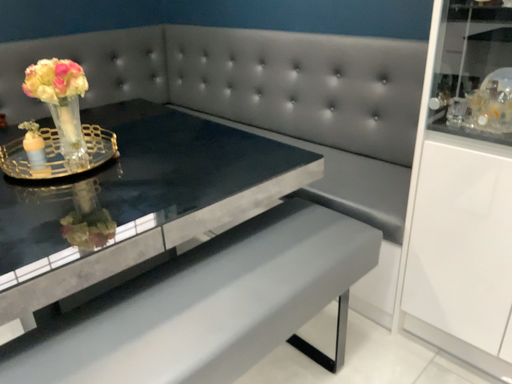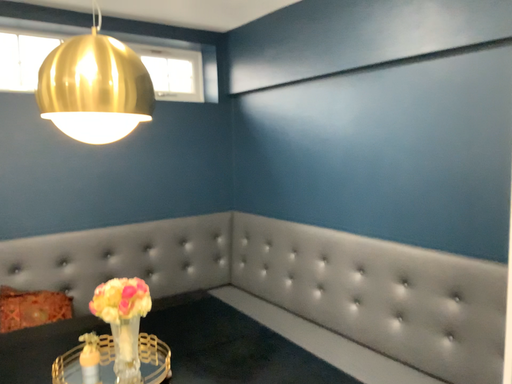
Question: Which way did the camera rotate in the video?

Choices:
 (A) rotated downward
 (B) rotated upward

Answer: (B)